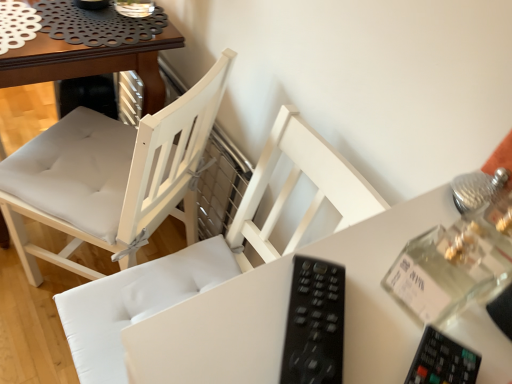
Question: Considering the positions of white wood chair at center, which ranks as the 1th chair in right-to-left order, and black plastic remote at center in the image, is white wood chair at center, which ranks as the 1th chair in right-to-left order, taller or shorter than black plastic remote at center?

Choices:
 (A) tall
 (B) short

Answer: (A)

Question: In the image, is white wood chair at center, placed as the second chair when sorted from left to right, on the left side or the right side of black plastic remote at center?

Choices:
 (A) right
 (B) left

Answer: (B)

Question: Considering the real-world distances, which object is closest to the white fabric chair at center, which ranks as the first chair in left-to-right order?

Choices:
 (A) white wood chair at center, which ranks as the 1th chair in right-to-left order
 (B) black plastic remote at center

Answer: (A)

Question: Which of these objects is positioned closest to the black plastic remote at center?

Choices:
 (A) white fabric chair at center, the 2th chair from the right
 (B) white wood chair at center, placed as the second chair when sorted from left to right

Answer: (B)